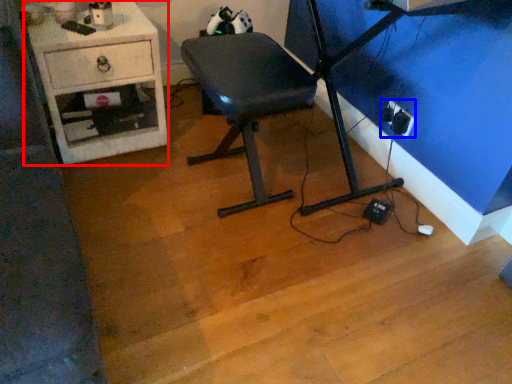
Question: Which of the following is the farthest to the observer, desk (highlighted by a red box) or electric outlet (highlighted by a blue box)?

Choices:
 (A) desk
 (B) electric outlet

Answer: (B)